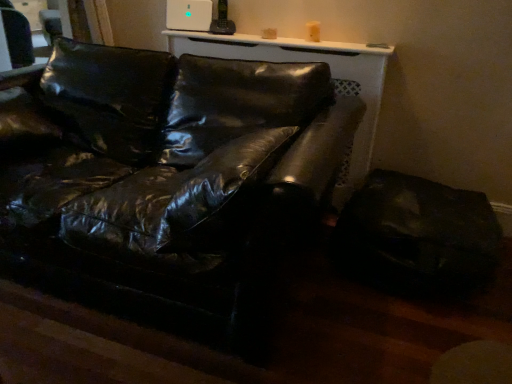
Identify the location of vacant space situated on the left part of shiny black leather swivel chair at lower right. (327, 303).